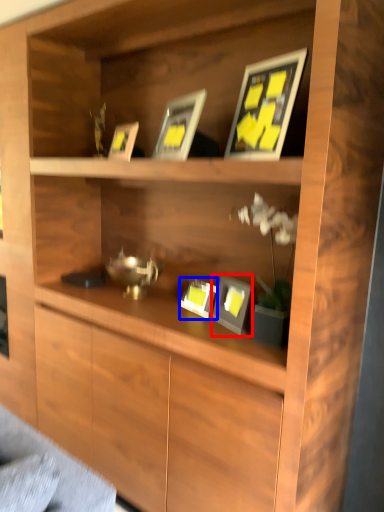
Question: Which of the following is the farthest to the observer, picture frame (highlighted by a red box) or picture frame (highlighted by a blue box)?

Choices:
 (A) picture frame
 (B) picture frame

Answer: (B)